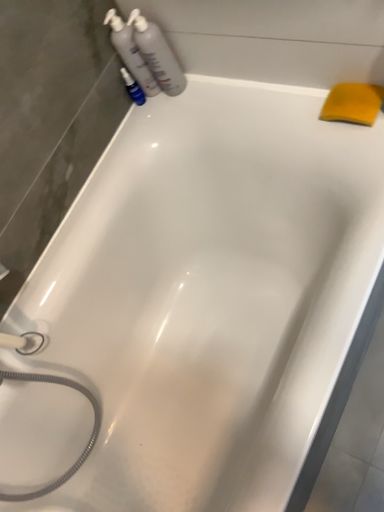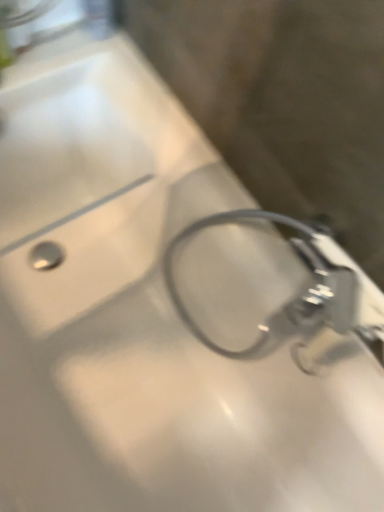
Question: How did the camera likely rotate when shooting the video?

Choices:
 (A) rotated right
 (B) rotated left

Answer: (B)